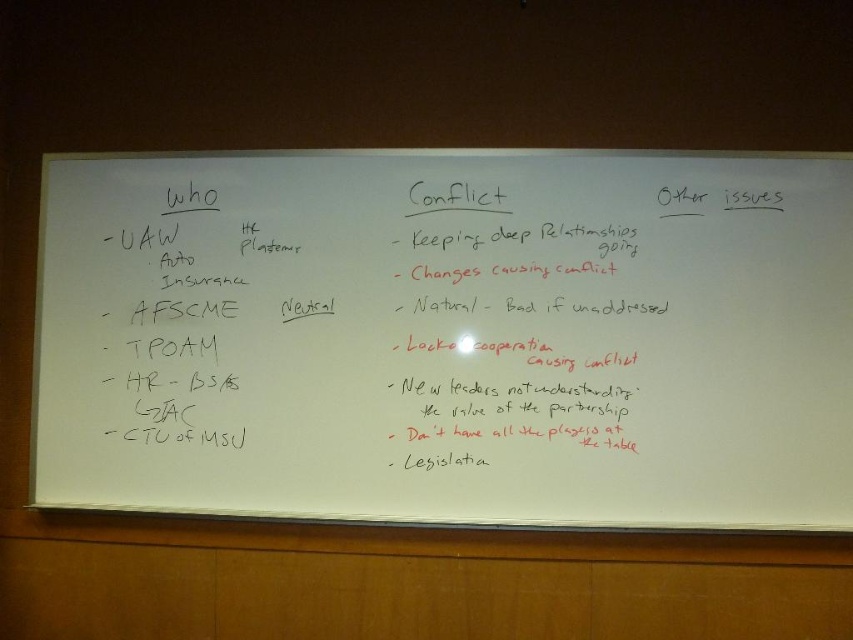
Question: Does whiteboard at center appear over black marker text at center?

Choices:
 (A) yes
 (B) no

Answer: (B)

Question: Which of the following is the closest to the observer?

Choices:
 (A) whiteboard at center
 (B) black marker text at center

Answer: (A)

Question: Which object appears closest to the camera in this image?

Choices:
 (A) black marker text at center
 (B) whiteboard at center

Answer: (B)

Question: Is whiteboard at center below black marker text at center?

Choices:
 (A) no
 (B) yes

Answer: (B)

Question: Is whiteboard at center above black marker text at center?

Choices:
 (A) yes
 (B) no

Answer: (B)